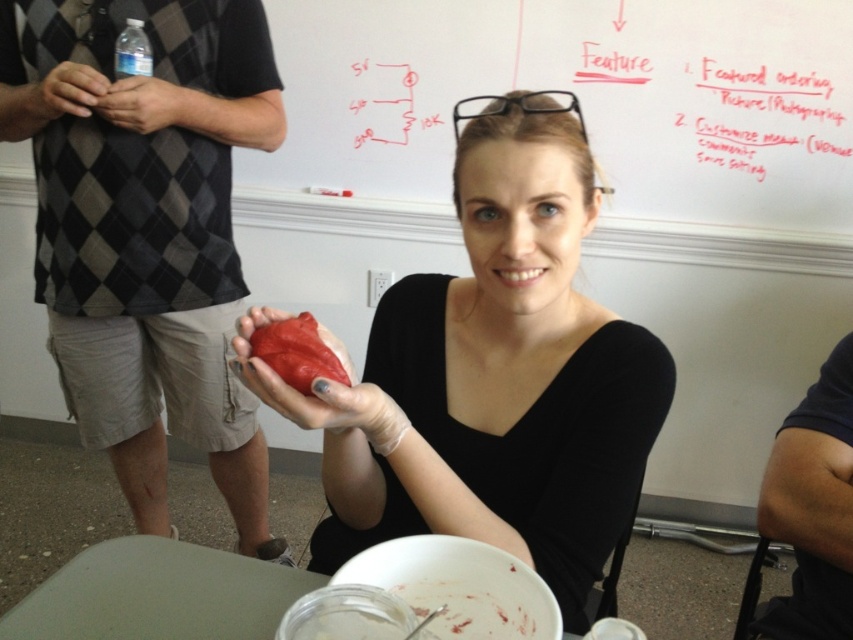
Is dark blue fabric at right thinner than matte plastic food at lower center?

Incorrect, dark blue fabric at right's width is not less than matte plastic food at lower center's.

Is point (759, 493) closer to viewer compared to point (427, 611)?

No, (759, 493) is behind (427, 611).

Between point (840, 620) and point (445, 625), which one is positioned behind?

Point (840, 620)

The image size is (853, 640). Find the location of `dark blue fabric at right`. dark blue fabric at right is located at coordinates coord(813,508).

Who is shorter, matte black sweater at upper left or clear plastic bottle at upper left?

With less height is clear plastic bottle at upper left.

The image size is (853, 640). Find the location of `matte black sweater at upper left`. matte black sweater at upper left is located at coordinates (149, 241).

Locate an element on the screen. matte black sweater at upper left is located at coordinates (149, 241).

Which is behind, point (474, 602) or point (123, 64)?

The point (123, 64) is more distant.

Does matte plastic food at lower center appear under clear plastic bottle at upper left?

Indeed, matte plastic food at lower center is positioned under clear plastic bottle at upper left.

Which is in front, point (453, 636) or point (126, 19)?

Positioned in front is point (453, 636).

Identify the location of matte plastic food at lower center. The height and width of the screenshot is (640, 853). (468, 611).